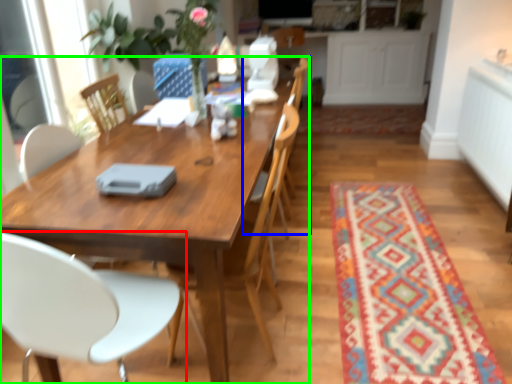
Question: Which object is positioned farthest from chair (highlighted by a red box)? Select from armchair (highlighted by a blue box) and kitchen & dining room table (highlighted by a green box).

Choices:
 (A) armchair
 (B) kitchen & dining room table

Answer: (A)